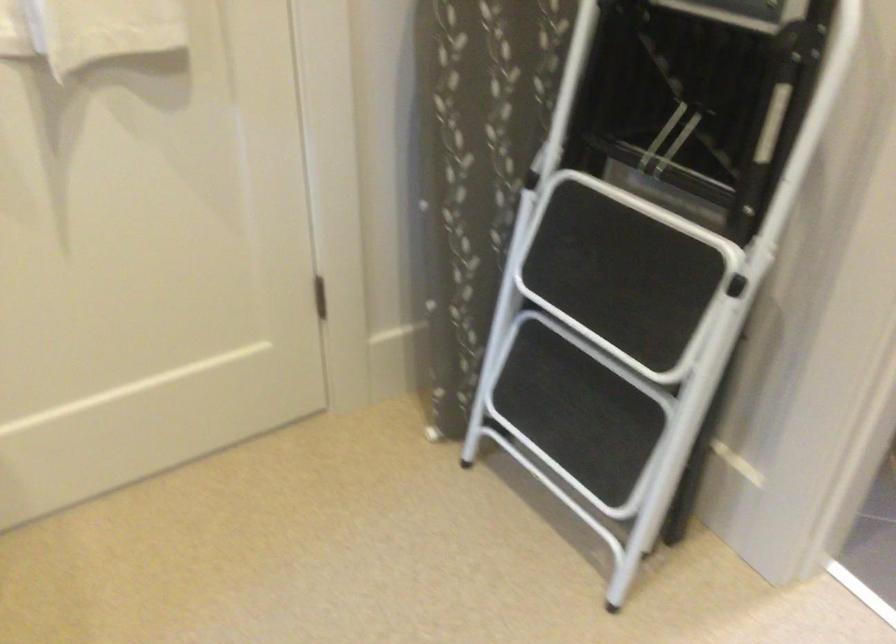
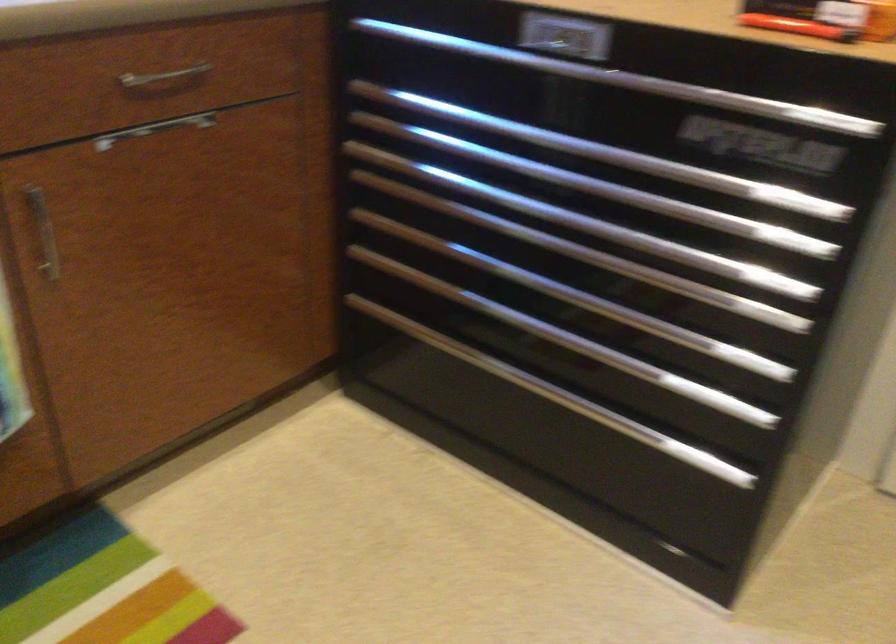
Question: Based on the continuous images, in which direction is the camera rotating? Reply with the corresponding letter.

Choices:
 (A) Left
 (B) Right
 (C) Up
 (D) Down

Answer: (A)